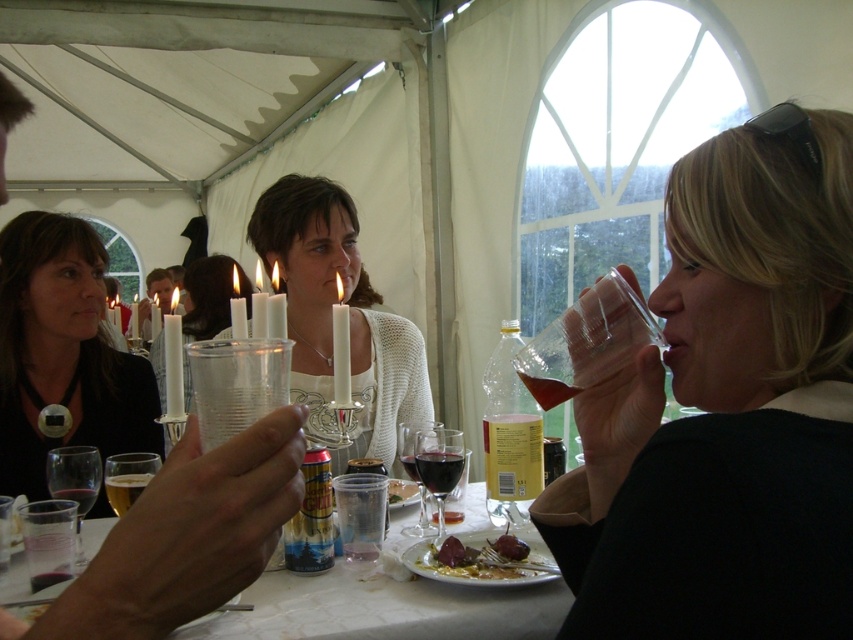
Question: Is white plastic plate at lower center closer to the viewer compared to translucent plastic glass at lower left?

Choices:
 (A) no
 (B) yes

Answer: (B)

Question: Can you confirm if white plastic plate at lower center is positioned below dark red glass at center?

Choices:
 (A) yes
 (B) no

Answer: (A)

Question: Which object is the farthest from the translucent plastic cup at lower left?

Choices:
 (A) smooth plastic cup at center
 (B) clear glass at right
 (C) white knitted sweater at center

Answer: (B)

Question: Does matte black dress at left appear under shiny dark red berry at plate center?

Choices:
 (A) no
 (B) yes

Answer: (A)

Question: Which object appears closest to the camera in this image?

Choices:
 (A) white knitted sweater at center
 (B) matte black dress at left

Answer: (A)

Question: Which object appears farthest from the camera in this image?

Choices:
 (A) matte black dress at left
 (B) red glass wine at center
 (C) white plastic plate at lower center
 (D) translucent plastic cup at lower left

Answer: (A)